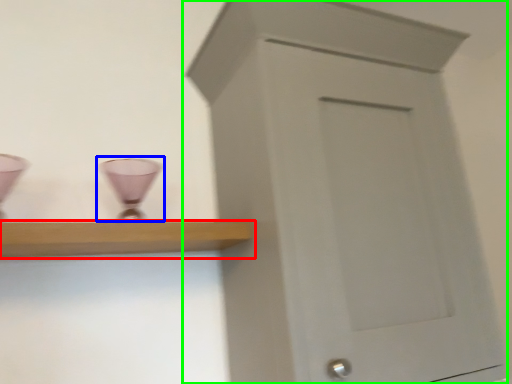
Question: Which is nearer to the shelf (highlighted by a red box)? candle holder (highlighted by a blue box) or cupboard (highlighted by a green box).

Choices:
 (A) candle holder
 (B) cupboard

Answer: (A)